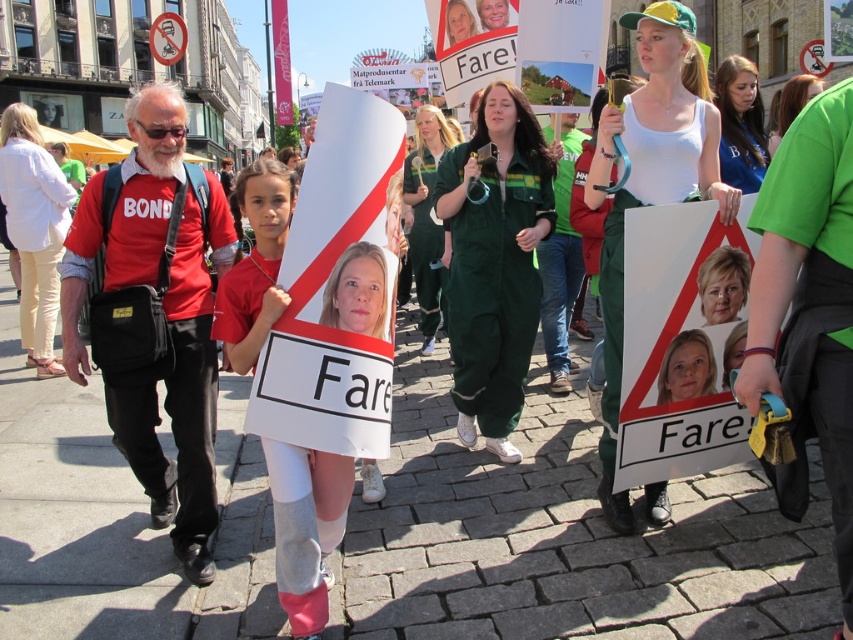
You are a photographer at the protest and want to capture a photo of both the green fabric jumpsuit at center and the matte blue shirt at center. Since you can only focus on one subject at a time, which one should you focus on to ensure the other is still in the background?

You should focus on the green fabric jumpsuit at center because the matte blue shirt at center is behind it, so focusing on the front subject will keep the background in better focus.